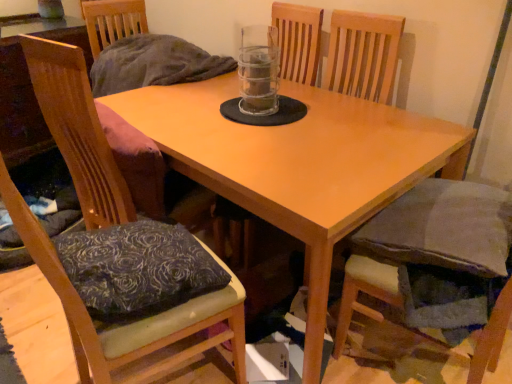
What do you see at coordinates (132, 323) in the screenshot? This screenshot has height=384, width=512. I see `wooden cushioned chair at left, which ranks as the second chair in right-to-left order` at bounding box center [132, 323].

The width and height of the screenshot is (512, 384). What are the coordinates of `velvet gray cushion at lower right, the 2th chair viewed from the left` in the screenshot? It's located at (436, 269).

The height and width of the screenshot is (384, 512). Describe the element at coordinates (137, 269) in the screenshot. I see `satin dark blue pillow at lower left` at that location.

At what (x,y) coordinates should I click in order to perform the action: click on light brown wooden table at center. Please return your answer as a coordinate pair (x, y). The image size is (512, 384). Looking at the image, I should click on (298, 165).

How different are the orientations of velvet gray cushion at lower right, the first chair when ordered from right to left, and light brown wooden table at center in degrees?

There is a 79.1-degree angle between the facing directions of velvet gray cushion at lower right, the first chair when ordered from right to left, and light brown wooden table at center.

From the image's perspective, count 2nd chairs downward from the light brown wooden table at center and point to it. Please provide its 2D coordinates.

[(436, 269)]

Considering the relative positions of velvet gray cushion at lower right, the first chair when ordered from right to left, and light brown wooden table at center in the image provided, is velvet gray cushion at lower right, the first chair when ordered from right to left, to the right of light brown wooden table at center from the viewer's perspective?

Yes, velvet gray cushion at lower right, the first chair when ordered from right to left, is to the right of light brown wooden table at center.

From a real-world perspective, who is located lower, velvet gray cushion at lower right, the first chair when ordered from right to left, or light brown wooden table at center?

From a 3D spatial view, light brown wooden table at center is below.

Is wooden cushioned chair at left, which ranks as the second chair in right-to-left order, at the right side of transparent plastic beverage at center?

No.

Is wooden cushioned chair at left, the first chair viewed from the left, with transparent plastic beverage at center?

There is a gap between wooden cushioned chair at left, the first chair viewed from the left, and transparent plastic beverage at center.

Is wooden cushioned chair at left, the first chair viewed from the left, shorter than transparent plastic beverage at center?

In fact, wooden cushioned chair at left, the first chair viewed from the left, may be taller than transparent plastic beverage at center.

Is wooden cushioned chair at left, which ranks as the second chair in right-to-left order, thinner than transparent plastic beverage at center?

No, wooden cushioned chair at left, which ranks as the second chair in right-to-left order, is not thinner than transparent plastic beverage at center.

Can you tell me how much light brown wooden table at center and satin dark blue pillow at lower left differ in facing direction?

The facing directions of light brown wooden table at center and satin dark blue pillow at lower left are 75.7 degrees apart.

From the image's perspective, which object appears higher, light brown wooden table at center or satin dark blue pillow at lower left?

light brown wooden table at center.

Does light brown wooden table at center have a larger size compared to satin dark blue pillow at lower left?

Yes, light brown wooden table at center is bigger than satin dark blue pillow at lower left.

The image size is (512, 384). In order to click on pillow on the left side of light brown wooden table at center in this screenshot , I will do `click(137, 269)`.

Consider the image. Relative to satin dark blue pillow at lower left, is wooden cushioned chair at left, which ranks as the second chair in right-to-left order, in front or behind?

wooden cushioned chair at left, which ranks as the second chair in right-to-left order, is positioned closer to the viewer than satin dark blue pillow at lower left.

Considering the relative sizes of wooden cushioned chair at left, which ranks as the second chair in right-to-left order, and satin dark blue pillow at lower left in the image provided, is wooden cushioned chair at left, which ranks as the second chair in right-to-left order, taller than satin dark blue pillow at lower left?

Yes.

Is wooden cushioned chair at left, which ranks as the second chair in right-to-left order, directly adjacent to satin dark blue pillow at lower left?

They are not placed beside each other.

Looking at this image, is wooden cushioned chair at left, which ranks as the second chair in right-to-left order, to the left or to the right of satin dark blue pillow at lower left in the image?

Based on their positions, wooden cushioned chair at left, which ranks as the second chair in right-to-left order, is located to the left of satin dark blue pillow at lower left.

Considering the relative positions of satin dark blue pillow at lower left and transparent plastic beverage at center in the image provided, is satin dark blue pillow at lower left to the left of transparent plastic beverage at center from the viewer's perspective?

Yes, satin dark blue pillow at lower left is to the left of transparent plastic beverage at center.

Does satin dark blue pillow at lower left have a greater height compared to transparent plastic beverage at center?

In fact, satin dark blue pillow at lower left may be shorter than transparent plastic beverage at center.

At what (x,y) coordinates should I click in order to perform the action: click on beverage that is behind the satin dark blue pillow at lower left. Please return your answer as a coordinate pair (x, y). Looking at the image, I should click on (258, 79).

From a real-world perspective, which object rests below the other?

satin dark blue pillow at lower left is physically lower.

Is velvet gray cushion at lower right, the 2th chair viewed from the left, in front of or behind transparent plastic beverage at center in the image?

velvet gray cushion at lower right, the 2th chair viewed from the left, is positioned closer to the viewer than transparent plastic beverage at center.

Considering the sizes of velvet gray cushion at lower right, the first chair when ordered from right to left, and transparent plastic beverage at center in the image, is velvet gray cushion at lower right, the first chair when ordered from right to left, taller or shorter than transparent plastic beverage at center?

Clearly, velvet gray cushion at lower right, the first chair when ordered from right to left, is shorter compared to transparent plastic beverage at center.

How many degrees apart are the facing directions of velvet gray cushion at lower right, the first chair when ordered from right to left, and transparent plastic beverage at center?

velvet gray cushion at lower right, the first chair when ordered from right to left, and transparent plastic beverage at center are facing 78.2 degrees away from each other.

In the image, there is a velvet gray cushion at lower right, the 2th chair viewed from the left. What are the coordinates of `beverage above it (from the image's perspective)` in the screenshot? It's located at (258, 79).

Is the depth of velvet gray cushion at lower right, the first chair when ordered from right to left, less than that of wooden cushioned chair at left, which ranks as the second chair in right-to-left order?

No, velvet gray cushion at lower right, the first chair when ordered from right to left, is further to the viewer.

In the scene shown: Considering the relative sizes of velvet gray cushion at lower right, the 2th chair viewed from the left, and wooden cushioned chair at left, the first chair viewed from the left, in the image provided, is velvet gray cushion at lower right, the 2th chair viewed from the left, wider than wooden cushioned chair at left, the first chair viewed from the left,?

Incorrect, the width of velvet gray cushion at lower right, the 2th chair viewed from the left, does not surpass that of wooden cushioned chair at left, the first chair viewed from the left.

Is velvet gray cushion at lower right, the 2th chair viewed from the left, touching wooden cushioned chair at left, which ranks as the second chair in right-to-left order?

velvet gray cushion at lower right, the 2th chair viewed from the left, is not next to wooden cushioned chair at left, which ranks as the second chair in right-to-left order, and they're not touching.

From a real-world perspective, is velvet gray cushion at lower right, the first chair when ordered from right to left, located higher than wooden cushioned chair at left, which ranks as the second chair in right-to-left order?

No, from a real-world perspective, velvet gray cushion at lower right, the first chair when ordered from right to left, is not over wooden cushioned chair at left, which ranks as the second chair in right-to-left order

Find the location of a particular element. This screenshot has height=384, width=512. chair behind the light brown wooden table at center is located at coordinates (436, 269).

You are a GUI agent. You are given a task and a screenshot of the screen. Output one action in this format:
    pyautogui.click(x=<x>, y=<y>)
    Task: Click on the beverage on the right of wooden cushioned chair at left, the first chair viewed from the left
    The width and height of the screenshot is (512, 384).
    Given the screenshot: What is the action you would take?
    pyautogui.click(x=258, y=79)

Considering their positions, is velvet gray cushion at lower right, the first chair when ordered from right to left, positioned further to light brown wooden table at center than wooden cushioned chair at left, the first chair viewed from the left?

The object further to light brown wooden table at center is wooden cushioned chair at left, the first chair viewed from the left.

From the image, which object appears to be nearer to transparent plastic beverage at center, wooden cushioned chair at left, the first chair viewed from the left, or light brown wooden table at center?

light brown wooden table at center is positioned closer to the anchor transparent plastic beverage at center.

In the scene shown: When comparing their distances from transparent plastic beverage at center, does wooden cushioned chair at left, which ranks as the second chair in right-to-left order, or velvet gray cushion at lower right, the first chair when ordered from right to left, seem closer?

wooden cushioned chair at left, which ranks as the second chair in right-to-left order, is positioned closer to the anchor transparent plastic beverage at center.

Which object lies nearer to the anchor point transparent plastic beverage at center, satin dark blue pillow at lower left or light brown wooden table at center?

The object closer to transparent plastic beverage at center is light brown wooden table at center.

When comparing their distances from transparent plastic beverage at center, does light brown wooden table at center or velvet gray cushion at lower right, the 2th chair viewed from the left, seem closer?

light brown wooden table at center lies closer to transparent plastic beverage at center than the other object.

When comparing their distances from satin dark blue pillow at lower left, does light brown wooden table at center or velvet gray cushion at lower right, the 2th chair viewed from the left, seem further?

Result: The object further to satin dark blue pillow at lower left is velvet gray cushion at lower right, the 2th chair viewed from the left.

Based on their spatial positions, is velvet gray cushion at lower right, the 2th chair viewed from the left, or satin dark blue pillow at lower left closer to light brown wooden table at center?

Based on the image, velvet gray cushion at lower right, the 2th chair viewed from the left, appears to be nearer to light brown wooden table at center.

Considering their positions, is wooden cushioned chair at left, which ranks as the second chair in right-to-left order, positioned closer to light brown wooden table at center than transparent plastic beverage at center?

Based on the image, transparent plastic beverage at center appears to be nearer to light brown wooden table at center.

The width and height of the screenshot is (512, 384). What are the coordinates of `table situated between satin dark blue pillow at lower left and velvet gray cushion at lower right, the first chair when ordered from right to left, from left to right` in the screenshot? It's located at pyautogui.click(x=298, y=165).

Locate an element on the screen. The image size is (512, 384). table between transparent plastic beverage at center and velvet gray cushion at lower right, the first chair when ordered from right to left, from top to bottom is located at coordinates (298, 165).

The height and width of the screenshot is (384, 512). Identify the location of pillow between wooden cushioned chair at left, which ranks as the second chair in right-to-left order, and velvet gray cushion at lower right, the first chair when ordered from right to left. click(x=137, y=269).

Find the location of `pillow between wooden cushioned chair at left, the first chair viewed from the left, and transparent plastic beverage at center from front to back`. pillow between wooden cushioned chair at left, the first chair viewed from the left, and transparent plastic beverage at center from front to back is located at coordinates (137, 269).